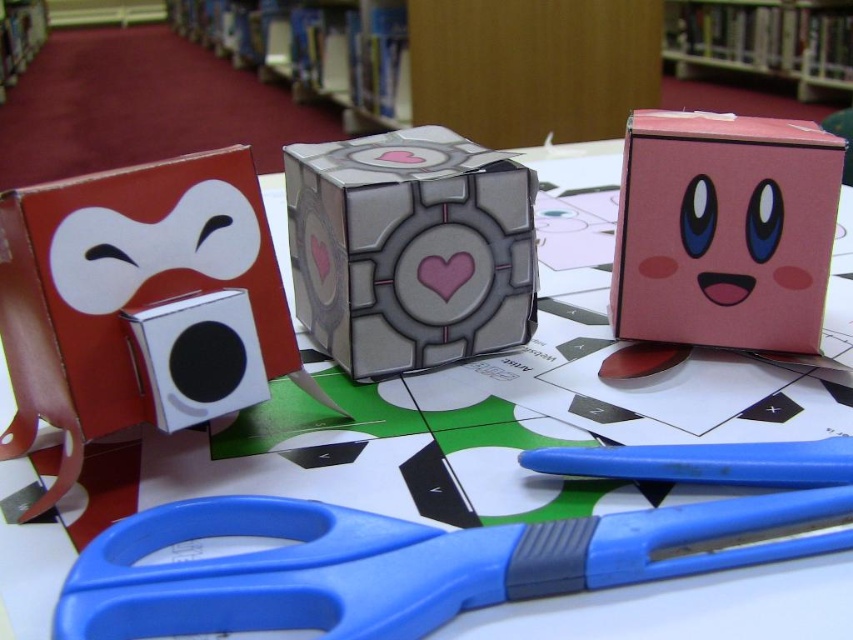
You are organizing a display in the library and need to place a new item between the white matte square at left and the pink matte box at center right. Based on their current positions, where should you place the new item to maintain alignment with the existing crafts?

The white matte square at left is positioned under the pink matte box at center right, so placing the new item between them would require positioning it to the right of the white matte square at left and to the left of the pink matte box at center right, maintaining a straight horizontal line with their alignment.